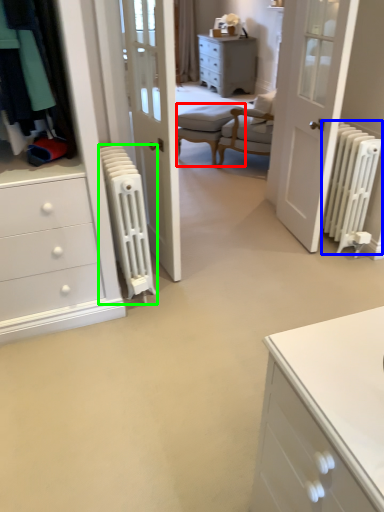
Question: Which object is the farthest from armchair (highlighted by a red box)? Choose among these: radiator (highlighted by a blue box) or radiator (highlighted by a green box).

Choices:
 (A) radiator
 (B) radiator

Answer: (B)